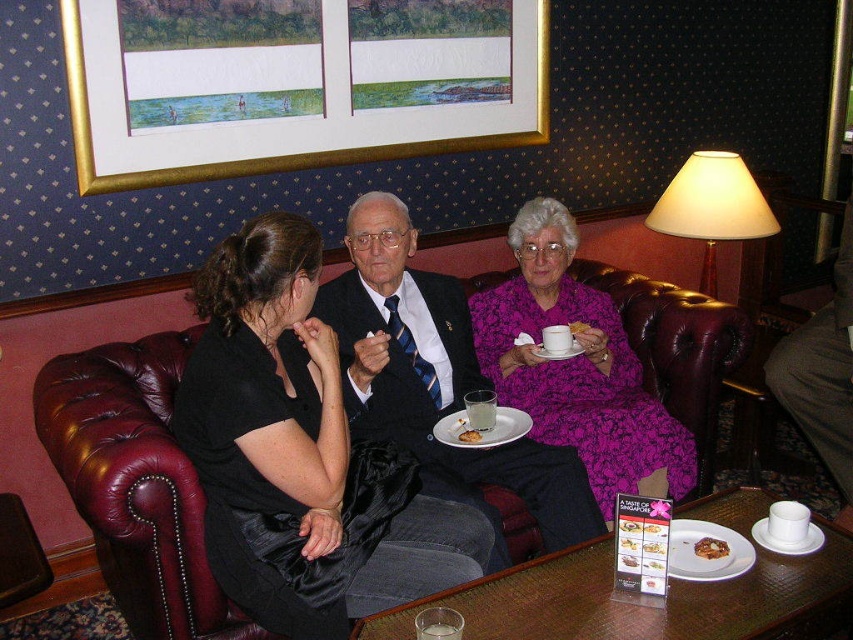
The height and width of the screenshot is (640, 853). Find the location of `leather armchair at center`. leather armchair at center is located at coordinates (135, 483).

Between leather armchair at center and translucent glass at center, which one has less height?

Standing shorter between the two is translucent glass at center.

Measure the distance between point (694,323) and camera.

8.47 feet

Locate an element on the screen. leather armchair at center is located at coordinates (135, 483).

Can you confirm if black satin dress at center is taller than purple floral dress at center?

No.

Measure the distance between black satin dress at center and camera.

5.43 feet

Which is in front, point (227, 412) or point (573, 237)?

Point (227, 412) is more forward.

Identify the location of black satin dress at center. (300, 454).

Is wooden textured table at lower center taller than slightly toasted bread at center?

Correct, wooden textured table at lower center is much taller as slightly toasted bread at center.

Between wooden textured table at lower center and slightly toasted bread at center, which one appears on the right side from the viewer's perspective?

wooden textured table at lower center

This screenshot has width=853, height=640. What are the coordinates of `wooden textured table at lower center` in the screenshot? It's located at click(646, 608).